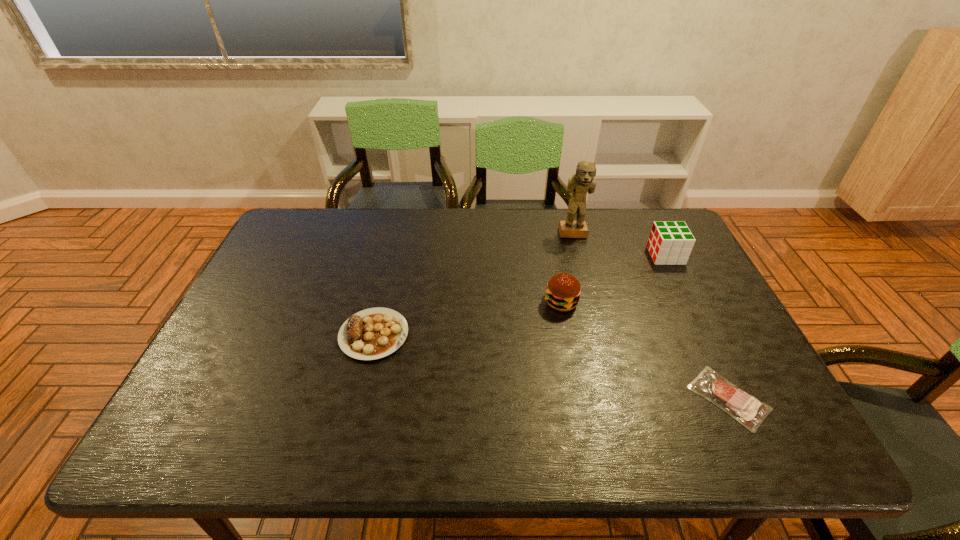
Locate an element on the screen. Image resolution: width=960 pixels, height=540 pixels. free spot between the left steak and the fourth nearest object is located at coordinates (x=519, y=295).

Locate an element on the screen. The height and width of the screenshot is (540, 960). free space between the farthest object and the leftmost object is located at coordinates (473, 285).

The width and height of the screenshot is (960, 540). I want to click on vacant area between the right steak and the fourth nearest object, so click(697, 327).

At what (x,y) coordinates should I click in order to perform the action: click on vacant area that lies between the taller steak and the hamburger. Please return your answer as a coordinate pair (x, y). Looking at the image, I should click on (468, 319).

Identify the location of free space that is in between the farthest object and the shorter steak. The width and height of the screenshot is (960, 540). (651, 316).

Where is `unoccupied position between the shorter steak and the taller steak`? unoccupied position between the shorter steak and the taller steak is located at coordinates (551, 366).

Locate an element on the screen. The height and width of the screenshot is (540, 960). empty space that is in between the left steak and the farthest object is located at coordinates (473, 285).

Locate which object is the closest to the shortest object. Please provide its 2D coordinates. Your answer should be formatted as a tuple, i.e. [(x, y)], where the tuple contains the x and y coordinates of a point satisfying the conditions above.

[(563, 291)]

Identify which object is the nearest to the left steak. Please provide its 2D coordinates. Your answer should be formatted as a tuple, i.e. [(x, y)], where the tuple contains the x and y coordinates of a point satisfying the conditions above.

[(563, 291)]

You are a GUI agent. You are given a task and a screenshot of the screen. Output one action in this format:
    pyautogui.click(x=<x>, y=<y>)
    Task: Click on the vacant space that satisfies the following two spatial constraints: 1. on the front side of the fourth tallest object; 2. on the left side of the nearer steak
    The height and width of the screenshot is (540, 960).
    Given the screenshot: What is the action you would take?
    pyautogui.click(x=359, y=398)